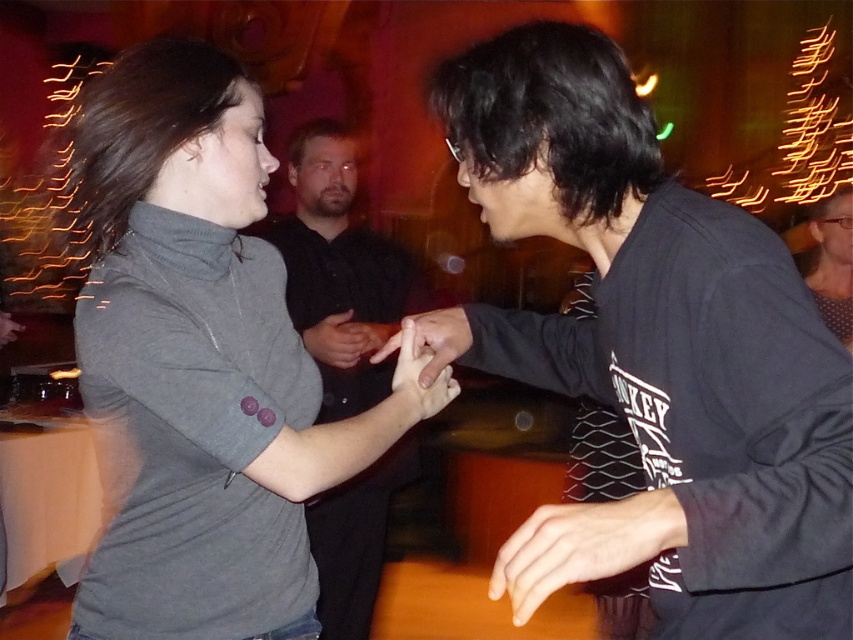
Question: Does smooth skin hand at center lie in front of matte gray hand at center?

Choices:
 (A) yes
 (B) no

Answer: (A)

Question: Can you confirm if matte gray sweater at center is thinner than matte black hand at center?

Choices:
 (A) no
 (B) yes

Answer: (B)

Question: Which point is farther to the camera?

Choices:
 (A) dark gray shirt at center
 (B) gray matte turtleneck at upper left
 (C) matte black hand at center

Answer: (C)

Question: Considering the real-world distances, which object is farthest from the matte gray hand at center?

Choices:
 (A) smooth skin hand at center
 (B) matte gray sweater at center
 (C) gray matte turtleneck at upper left
 (D) matte black hand at center

Answer: (B)

Question: Which of the following is the closest to the observer?

Choices:
 (A) gray matte turtleneck at upper left
 (B) dark gray shirt at center

Answer: (A)

Question: Can you confirm if gray matte turtleneck at upper left is positioned above matte gray sweater at center?

Choices:
 (A) no
 (B) yes

Answer: (A)